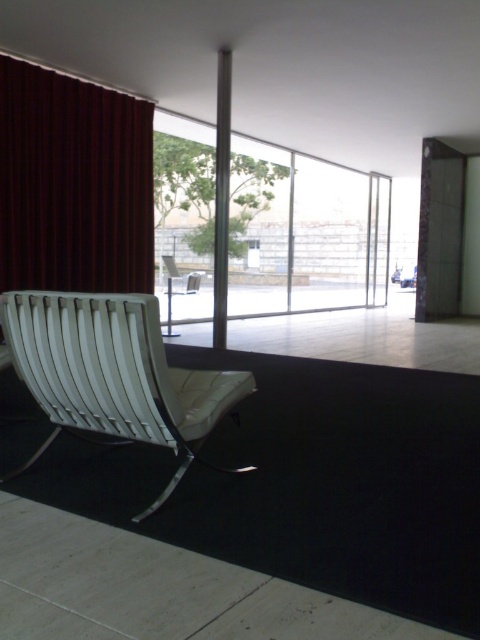
Question: Considering the relative positions of dark red velvet curtain at left and metallic silver chair at center in the image provided, where is dark red velvet curtain at left located with respect to metallic silver chair at center?

Choices:
 (A) above
 (B) below

Answer: (A)

Question: Is white leather armchair at left positioned before metallic silver chair at center?

Choices:
 (A) no
 (B) yes

Answer: (B)

Question: Which point is farther to the camera?

Choices:
 (A) pyautogui.click(x=156, y=380)
 (B) pyautogui.click(x=72, y=188)

Answer: (B)

Question: Which point appears closest to the camera in this image?

Choices:
 (A) (29, 68)
 (B) (172, 280)
 (C) (147, 364)

Answer: (C)

Question: Can you confirm if white leather armchair at left is positioned to the left of metallic silver chair at center?

Choices:
 (A) no
 (B) yes

Answer: (A)

Question: Which object is closer to the camera taking this photo?

Choices:
 (A) metallic silver chair at center
 (B) white leather armchair at left
 (C) dark red velvet curtain at left

Answer: (B)